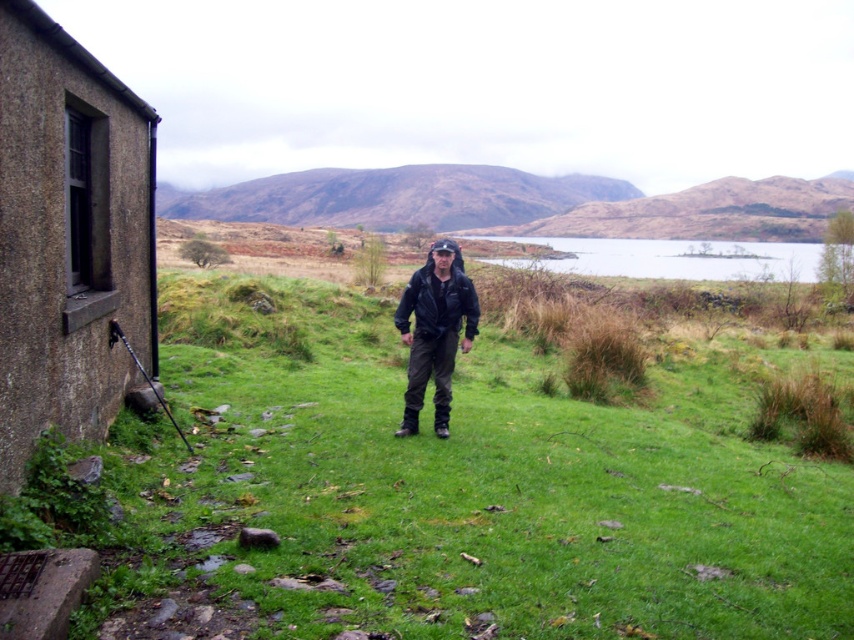
You are a drone operator trying to locate a specific point in a rural landscape. The scene includes a man dressed in outdoor gear standing near a rustic building. There is a point marked at coordinates (449,493). What is the feature at this coordinate?

The point at coordinates (449,493) corresponds to the green grassy area at the center of the scene.

Based on the photo, you are planning to set up a small tent in the scene. Given the green grassy at center and the clear water at center, which area would be more suitable for placing the tent and why?

The green grassy at center has a lesser width compared to clear water at center. Therefore, the clear water at center is wider and more suitable for placing the tent as it provides a larger and stable area.

You are a hiker who wants to take a photo of the brown textured stone hut at left and the black leather jacket at center. Which object should you focus on first if you want to capture both in the same frame without moving the camera?

The brown textured stone hut at left is taller than the black leather jacket at center, so you should focus on the brown textured stone hut at left first to ensure it fits within the frame.